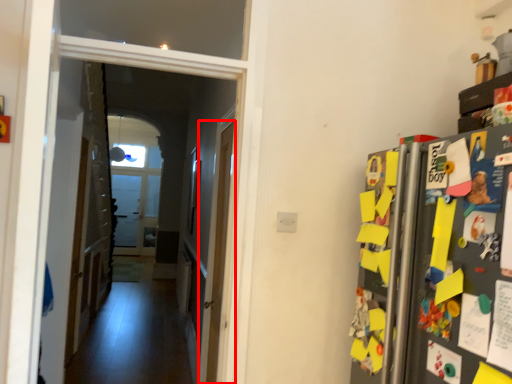
Question: In this image, where is door (annotated by the red box) located relative to corridor?

Choices:
 (A) left
 (B) right

Answer: (B)